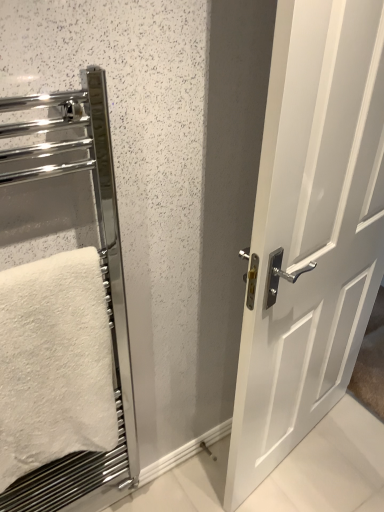
Question: Is chrome metallic towel rack at left wider or thinner than white fluffy towel at left?

Choices:
 (A) thin
 (B) wide

Answer: (A)

Question: From a real-world perspective, is chrome metallic towel rack at left physically located above or below white fluffy towel at left?

Choices:
 (A) above
 (B) below

Answer: (B)

Question: Based on their relative distances, which object is farther from the chrome metallic towel rack at left?

Choices:
 (A) white fluffy towel at left
 (B) white glossy door at center

Answer: (B)

Question: Which object is positioned closest to the chrome metallic towel rack at left?

Choices:
 (A) white fluffy towel at left
 (B) white glossy door at center

Answer: (A)